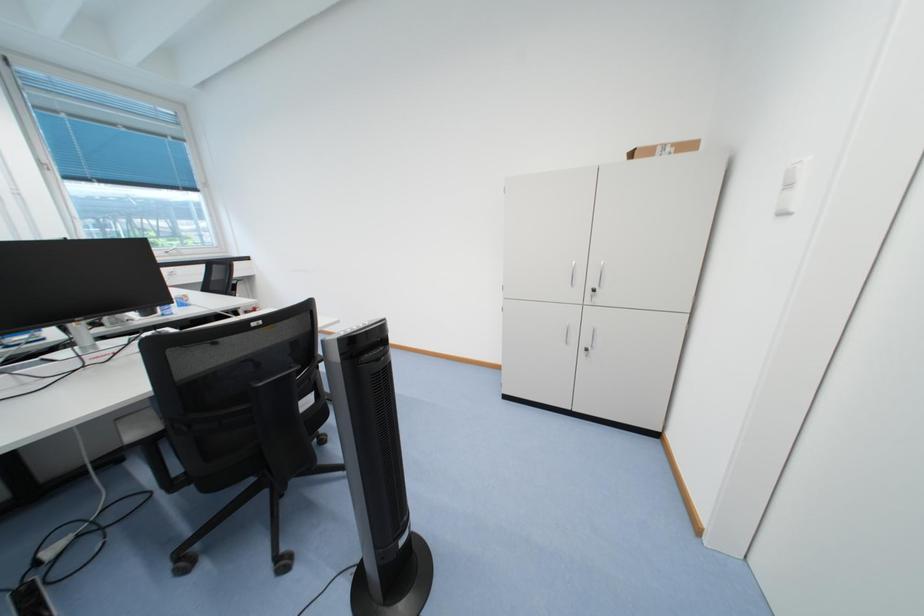
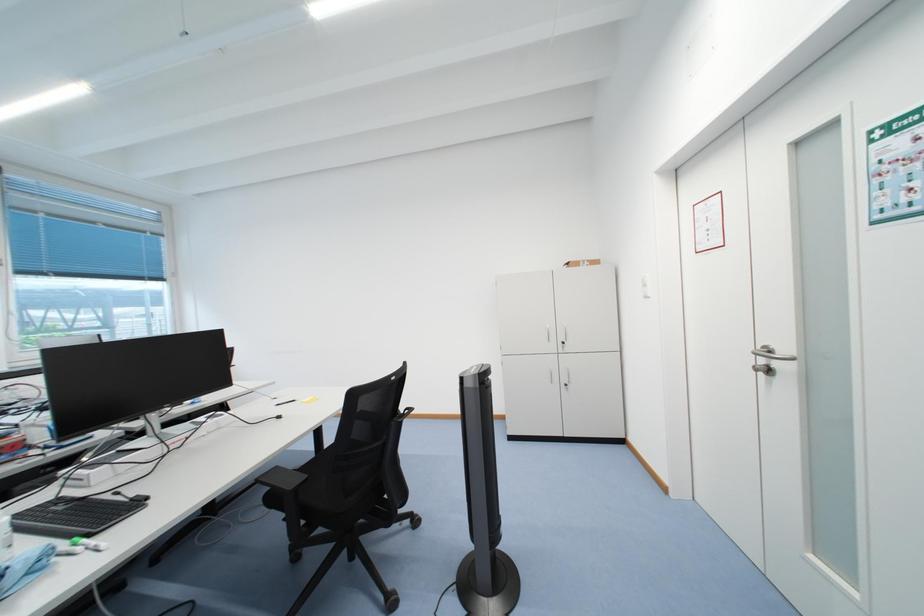
The images are taken continuously from a first-person perspective. In which direction are you moving?

The cameraman moved toward left, backward.